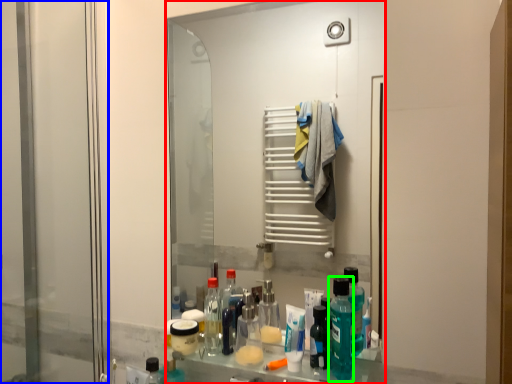
Question: Which object is the farthest from mirror (highlighted by a red box)? Choose among these: screen door (highlighted by a blue box) or cleaning product (highlighted by a green box).

Choices:
 (A) screen door
 (B) cleaning product

Answer: (B)